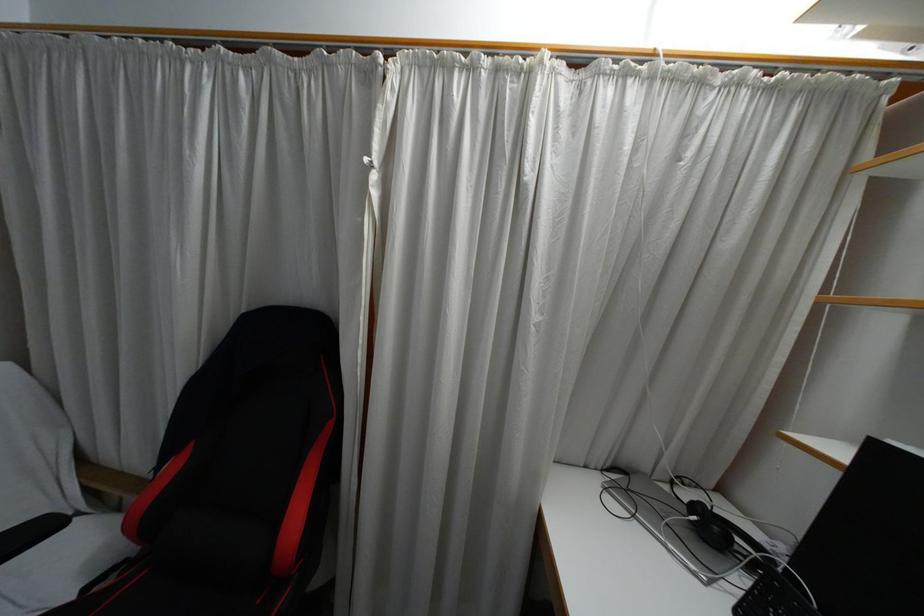
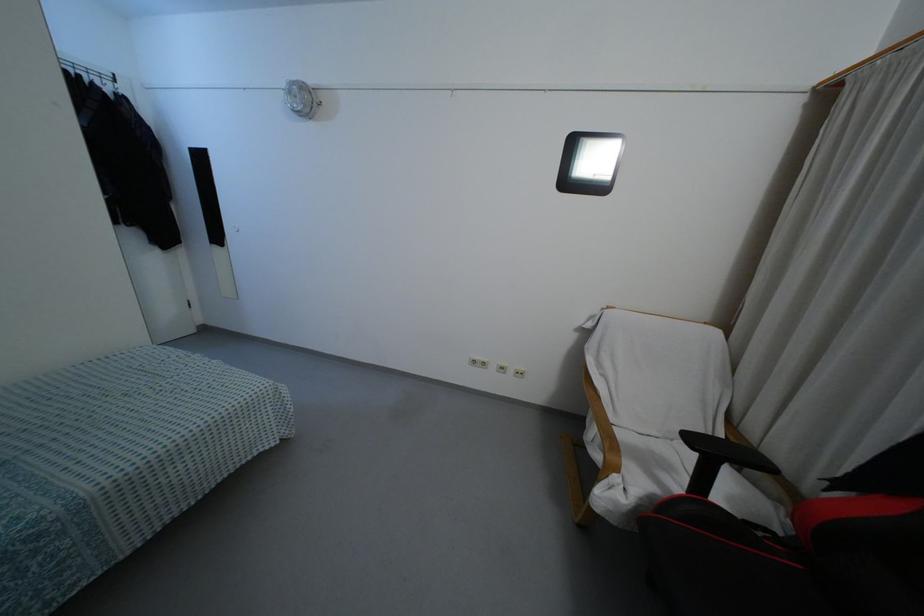
Question: The camera is either moving clockwise (left) or counter-clockwise (right) around the object. The first image is from the beginning of the video and the second image is from the end. Is the camera moving left or right when shooting the video?

Choices:
 (A) Left
 (B) Right

Answer: (B)